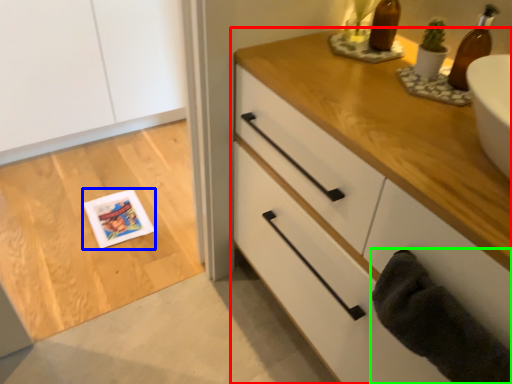
Question: Considering the real-world distances, which object is closest to chest of drawers (highlighted by a red box)? postcard (highlighted by a blue box) or bath towel (highlighted by a green box).

Choices:
 (A) postcard
 (B) bath towel

Answer: (B)